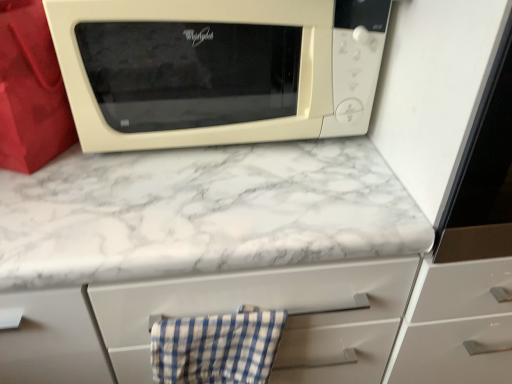
The image size is (512, 384). In order to click on blue checkered cloth at lower center in this screenshot , I will do `click(217, 347)`.

Describe the element at coordinates (202, 212) in the screenshot. This screenshot has width=512, height=384. I see `white marble countertop at upper center` at that location.

What are the coordinates of `blue checkered cloth at lower center` in the screenshot? It's located at (217, 347).

From the image's perspective, is white marble countertop at upper center positioned above or below beige matte microwave at upper center?

white marble countertop at upper center is below beige matte microwave at upper center.

Considering the sizes of objects white marble countertop at upper center and beige matte microwave at upper center in the image provided, who is taller, white marble countertop at upper center or beige matte microwave at upper center?

Standing taller between the two is white marble countertop at upper center.

Looking at their sizes, would you say white marble countertop at upper center is wider or thinner than beige matte microwave at upper center?

In the image, white marble countertop at upper center appears to be wider than beige matte microwave at upper center.

Who is more distant, white marble countertop at upper center or beige matte microwave at upper center?

beige matte microwave at upper center is more distant.

How many degrees apart are the facing directions of beige matte microwave at upper center and white marble countertop at upper center?

There is a 1.58-degree angle between the facing directions of beige matte microwave at upper center and white marble countertop at upper center.

Considering the relative sizes of beige matte microwave at upper center and white marble countertop at upper center in the image provided, is beige matte microwave at upper center thinner than white marble countertop at upper center?

Yes.

This screenshot has height=384, width=512. Find the location of `countertop that appears in front of the beige matte microwave at upper center`. countertop that appears in front of the beige matte microwave at upper center is located at coordinates (202, 212).

From a real-world perspective, who is located higher, beige matte microwave at upper center or white marble countertop at upper center?

beige matte microwave at upper center.

Can we say blue checkered cloth at lower center lies outside white marble countertop at upper center?

No, most part of blue checkered cloth at lower center lies within white marble countertop at upper center.

Is blue checkered cloth at lower center facing towards white marble countertop at upper center?

No.

Considering the positions of objects blue checkered cloth at lower center and white marble countertop at upper center in the image provided, who is more to the left, blue checkered cloth at lower center or white marble countertop at upper center?

Positioned to the left is white marble countertop at upper center.

How much distance is there between blue checkered cloth at lower center and white marble countertop at upper center?

blue checkered cloth at lower center is 7.68 inches from white marble countertop at upper center.

Does point (151, 13) come behind point (222, 382)?

No, (151, 13) is closer to viewer.

From a real-world perspective, between beige matte microwave at upper center and blue checkered cloth at lower center, who is vertically lower?

From a 3D spatial view, blue checkered cloth at lower center is below.

Considering the positions of objects white marble countertop at upper center and blue checkered cloth at lower center in the image provided, who is in front, white marble countertop at upper center or blue checkered cloth at lower center?

white marble countertop at upper center is in front.

How much distance is there between white marble countertop at upper center and blue checkered cloth at lower center?

They are 7.68 inches apart.

Consider the image. Does white marble countertop at upper center have a smaller size compared to blue checkered cloth at lower center?

No.

Is white marble countertop at upper center shorter than blue checkered cloth at lower center?

Incorrect, the height of white marble countertop at upper center does not fall short of that of blue checkered cloth at lower center.

Is blue checkered cloth at lower center in contact with beige matte microwave at upper center?

No, blue checkered cloth at lower center is not with beige matte microwave at upper center.

Considering the points (191, 352) and (58, 46), which point is behind, point (191, 352) or point (58, 46)?

The point (191, 352) is behind.

The image size is (512, 384). What are the coordinates of `hand towel located below the beige matte microwave at upper center (from the image's perspective)` in the screenshot? It's located at (217, 347).

Looking at this image, considering the relative positions of blue checkered cloth at lower center and beige matte microwave at upper center in the image provided, is blue checkered cloth at lower center in front of beige matte microwave at upper center?

No, blue checkered cloth at lower center is further to the viewer.

Find the location of a particular element. The image size is (512, 384). countertop on the left of beige matte microwave at upper center is located at coordinates (202, 212).

At what (x,y) coordinates should I click in order to perform the action: click on countertop below the beige matte microwave at upper center (from the image's perspective). Please return your answer as a coordinate pair (x, y). Looking at the image, I should click on (202, 212).

Considering their positions, is white marble countertop at upper center positioned closer to blue checkered cloth at lower center than beige matte microwave at upper center?

Among the two, white marble countertop at upper center is located nearer to blue checkered cloth at lower center.

Considering their positions, is beige matte microwave at upper center positioned further to blue checkered cloth at lower center than white marble countertop at upper center?

beige matte microwave at upper center.

Considering their positions, is blue checkered cloth at lower center positioned further to beige matte microwave at upper center than white marble countertop at upper center?

Among the two, blue checkered cloth at lower center is located further to beige matte microwave at upper center.

Looking at the image, which one is located further to beige matte microwave at upper center, white marble countertop at upper center or blue checkered cloth at lower center?

blue checkered cloth at lower center lies further to beige matte microwave at upper center than the other object.

Which object lies nearer to the anchor point white marble countertop at upper center, beige matte microwave at upper center or blue checkered cloth at lower center?

beige matte microwave at upper center lies closer to white marble countertop at upper center than the other object.

When comparing their distances from white marble countertop at upper center, does blue checkered cloth at lower center or beige matte microwave at upper center seem closer?

The object closer to white marble countertop at upper center is beige matte microwave at upper center.

Where is `hand towel that lies between beige matte microwave at upper center and white marble countertop at upper center from top to bottom`? hand towel that lies between beige matte microwave at upper center and white marble countertop at upper center from top to bottom is located at coordinates (217, 347).